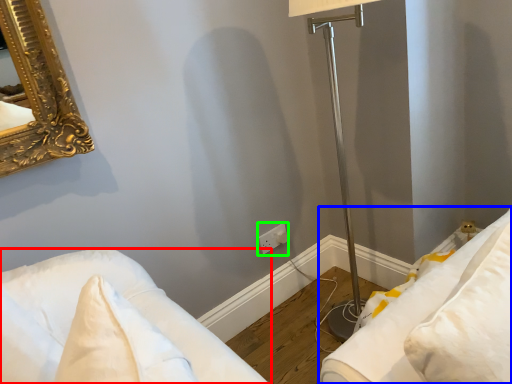
Question: Which object is the farthest from furniture (highlighted by a red box)? Choose among these: furniture (highlighted by a blue box) or electric outlet (highlighted by a green box).

Choices:
 (A) furniture
 (B) electric outlet

Answer: (B)